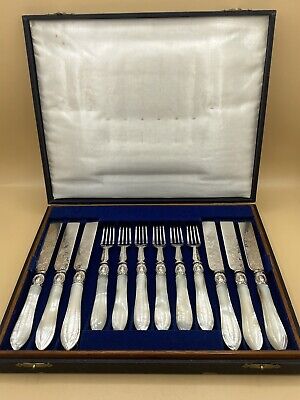
At what (x,y) coordinates should I click in order to perform the action: click on silver knives. Please return your answer as a coordinate pair (x, y). The image size is (300, 400). Looking at the image, I should click on (21, 331), (41, 332), (70, 335), (227, 332), (248, 338), (282, 339).